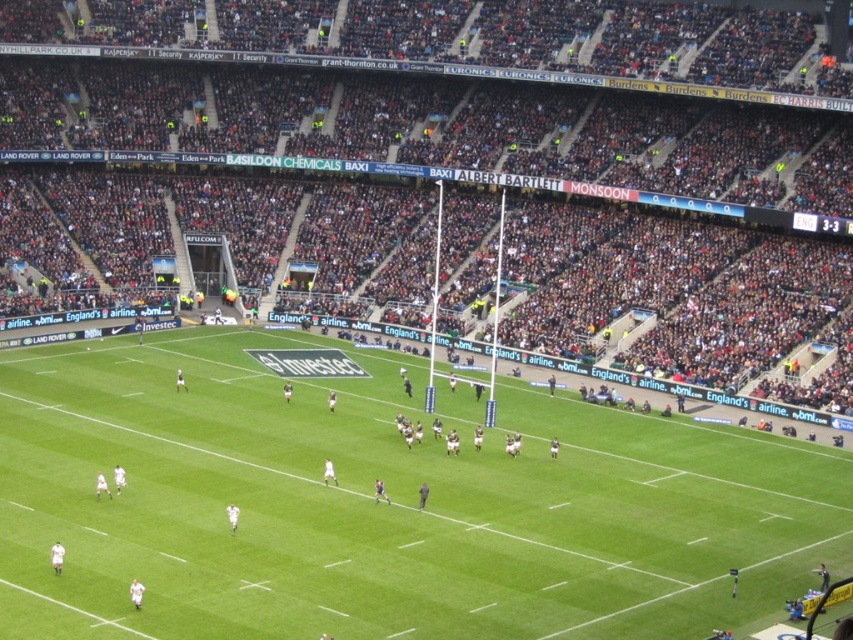
Question: Which object appears closest to the camera in this image?

Choices:
 (A) dark gray stadium seats at center
 (B) green grass football field at center

Answer: (B)

Question: In this image, where is dark gray stadium seats at center located relative to green grass football field at center?

Choices:
 (A) right
 (B) left

Answer: (A)

Question: Is dark gray stadium seats at center below green grass football field at center?

Choices:
 (A) no
 (B) yes

Answer: (A)

Question: Is dark gray stadium seats at center to the left of green grass football field at center from the viewer's perspective?

Choices:
 (A) yes
 (B) no

Answer: (B)